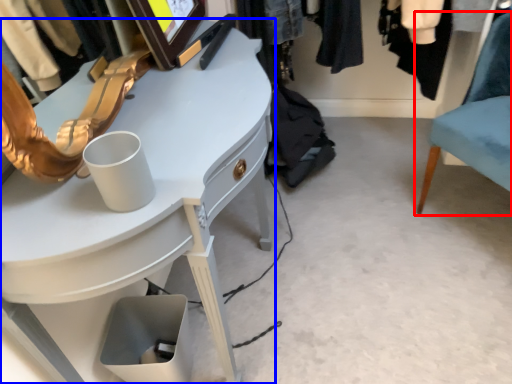
Question: Which object appears closest to the camera in this image, chair (highlighted by a red box) or desk (highlighted by a blue box)?

Choices:
 (A) chair
 (B) desk

Answer: (B)